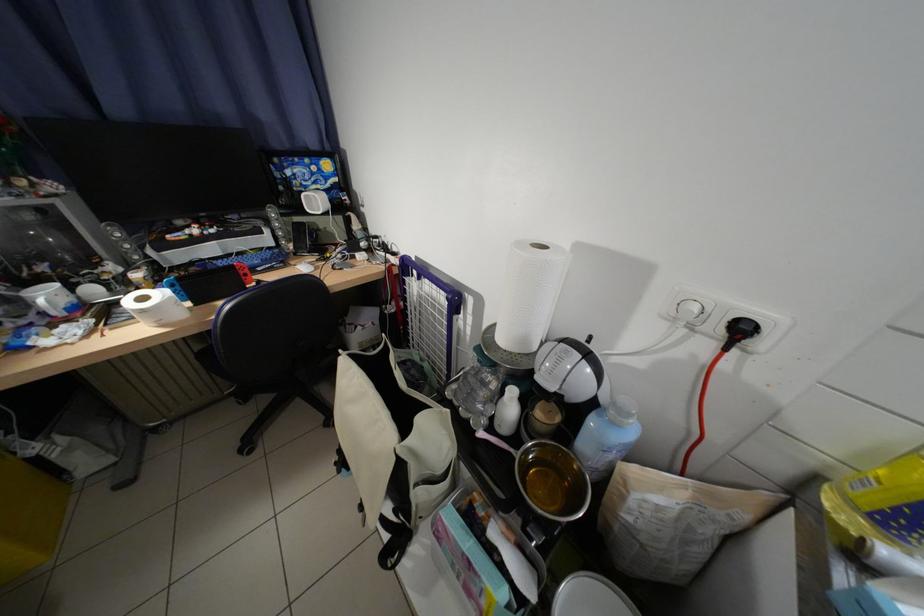
Which object does [707,397] point to?

This point indicates the red gaming controller.